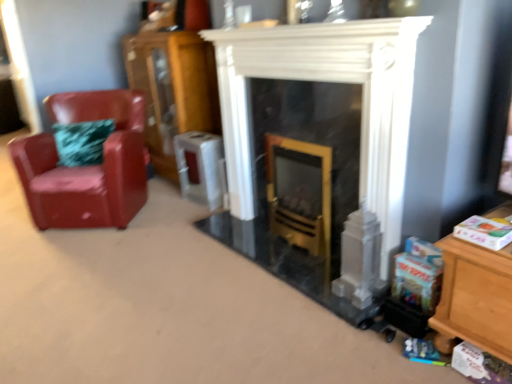
Question: Does glossy leather chair at left appear on the right side of white marble fireplace at center?

Choices:
 (A) yes
 (B) no

Answer: (B)

Question: From the image's perspective, is glossy leather chair at left located above white marble fireplace at center?

Choices:
 (A) no
 (B) yes

Answer: (B)

Question: Is glossy leather chair at left at the left side of white marble fireplace at center?

Choices:
 (A) yes
 (B) no

Answer: (A)

Question: Is glossy leather chair at left completely or partially outside of white marble fireplace at center?

Choices:
 (A) yes
 (B) no

Answer: (A)

Question: Can you confirm if glossy leather chair at left is taller than white marble fireplace at center?

Choices:
 (A) yes
 (B) no

Answer: (B)

Question: From their relative heights in the image, would you say glossy leather chair at left is taller or shorter than wooden cabinet at left?

Choices:
 (A) tall
 (B) short

Answer: (B)

Question: Based on their positions, is glossy leather chair at left located to the left or right of wooden cabinet at left?

Choices:
 (A) right
 (B) left

Answer: (B)

Question: Considering the positions of glossy leather chair at left and wooden cabinet at left in the image, is glossy leather chair at left bigger or smaller than wooden cabinet at left?

Choices:
 (A) big
 (B) small

Answer: (A)

Question: Choose the correct answer: Is glossy leather chair at left inside wooden cabinet at left or outside it?

Choices:
 (A) outside
 (B) inside

Answer: (A)

Question: Do you think white marble fireplace at center is within glossy leather chair at left, or outside of it?

Choices:
 (A) inside
 (B) outside

Answer: (B)

Question: Is white marble fireplace at center taller or shorter than glossy leather chair at left?

Choices:
 (A) tall
 (B) short

Answer: (A)

Question: Does point (361, 79) appear closer or farther from the camera than point (41, 165)?

Choices:
 (A) closer
 (B) farther

Answer: (A)

Question: Considering the positions of white marble fireplace at center and glossy leather chair at left in the image, is white marble fireplace at center bigger or smaller than glossy leather chair at left?

Choices:
 (A) small
 (B) big

Answer: (A)

Question: Considering the positions of wooden cabinet at left and glossy leather chair at left in the image, is wooden cabinet at left taller or shorter than glossy leather chair at left?

Choices:
 (A) short
 (B) tall

Answer: (B)

Question: Considering the positions of wooden cabinet at left and glossy leather chair at left in the image, is wooden cabinet at left bigger or smaller than glossy leather chair at left?

Choices:
 (A) big
 (B) small

Answer: (B)